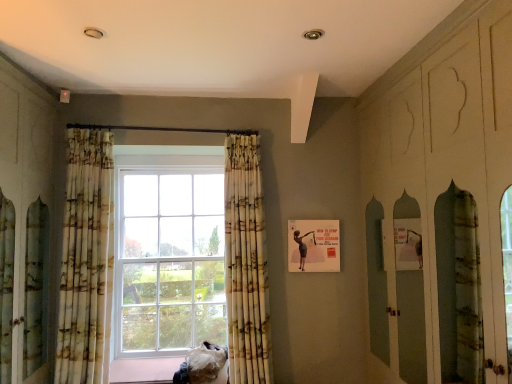
Question: Is fuzzy fabric cat at lower center inside the boundaries of printed fabric curtain at left, the 2th curtain in the right-to-left sequence, or outside?

Choices:
 (A) inside
 (B) outside

Answer: (B)

Question: From a real-world perspective, relative to printed fabric curtain at left, which is the first curtain in left-to-right order, is fuzzy fabric cat at lower center vertically above or below?

Choices:
 (A) below
 (B) above

Answer: (A)

Question: Which object is the closest to the fuzzy fabric cat at lower center?

Choices:
 (A) printed fabric curtain at center, which is the first curtain in right-to-left order
 (B) printed fabric curtain at left, the 2th curtain in the right-to-left sequence

Answer: (A)

Question: Which object is the closest to the printed fabric curtain at center, which is the first curtain in right-to-left order?

Choices:
 (A) printed fabric curtain at left, the 2th curtain in the right-to-left sequence
 (B) fuzzy fabric cat at lower center

Answer: (B)